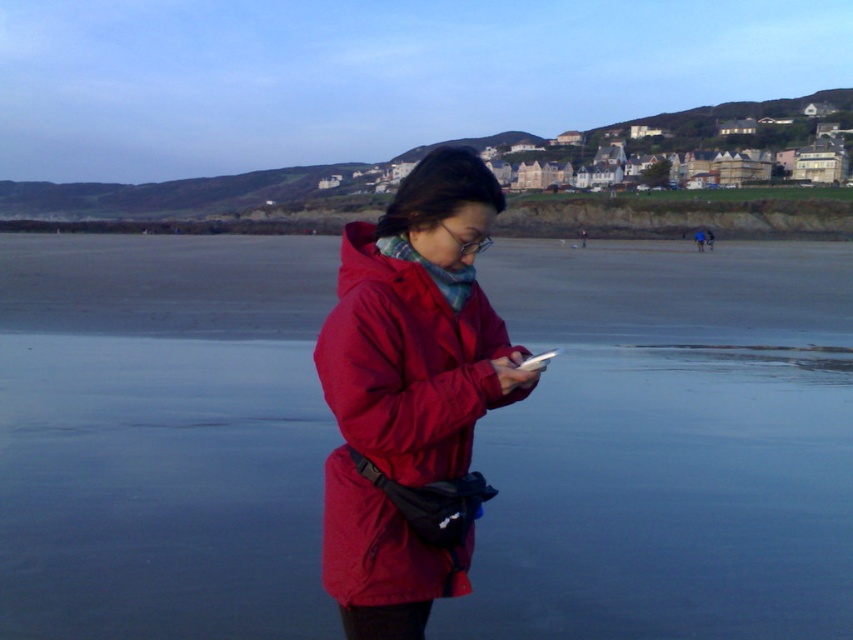
Consider the image. Between transparent water at center and matte red jacket at center, which one is positioned lower?

Positioned lower is matte red jacket at center.

Does transparent water at center appear on the right side of matte red jacket at center?

Indeed, transparent water at center is positioned on the right side of matte red jacket at center.

This screenshot has height=640, width=853. What do you see at coordinates (666, 448) in the screenshot?
I see `transparent water at center` at bounding box center [666, 448].

The height and width of the screenshot is (640, 853). What are the coordinates of `transparent water at center` in the screenshot? It's located at (666, 448).